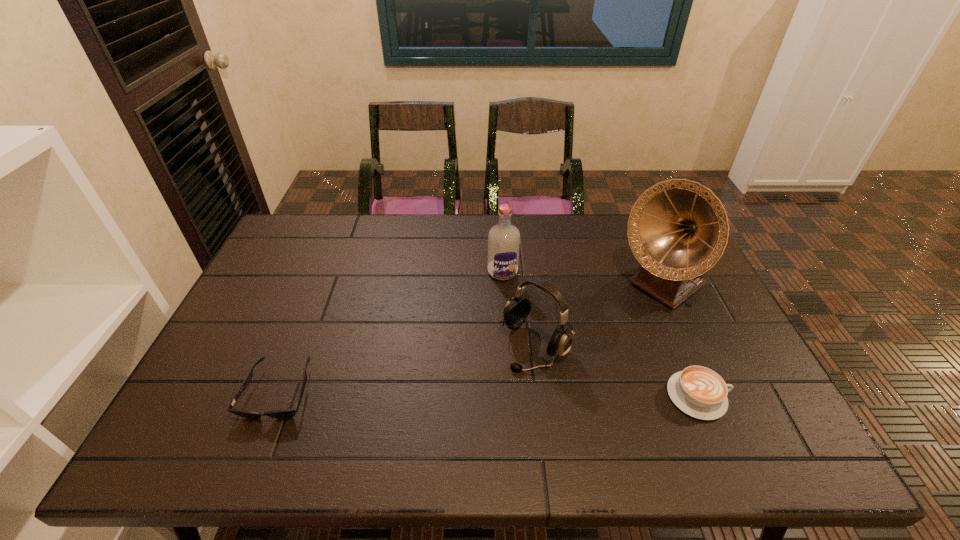
Image resolution: width=960 pixels, height=540 pixels. I want to click on blank space located on the label of the vodka, so click(508, 294).

Where is `free region located with the microphone on the side of the headset`? free region located with the microphone on the side of the headset is located at coordinates (486, 394).

Image resolution: width=960 pixels, height=540 pixels. Find the location of `free location located 0.060m with the microphone on the side of the headset`. free location located 0.060m with the microphone on the side of the headset is located at coordinates (499, 381).

Locate an element on the screen. The width and height of the screenshot is (960, 540). vacant position located 0.190m with the microphone on the side of the headset is located at coordinates (463, 415).

Image resolution: width=960 pixels, height=540 pixels. Identify the location of sunglasses that is positioned at the near edge. (287, 413).

What are the coordinates of `cappuccino present at the near edge` in the screenshot? It's located at (698, 391).

This screenshot has width=960, height=540. I want to click on object that is at the left edge, so click(x=287, y=413).

Where is `cappuccino located at the right edge`? This screenshot has height=540, width=960. cappuccino located at the right edge is located at coordinates (698, 391).

Identify the location of phonograph record located in the right edge section of the desktop. This screenshot has height=540, width=960. (678, 229).

In order to click on object that is at the near left corner in this screenshot , I will do `click(287, 413)`.